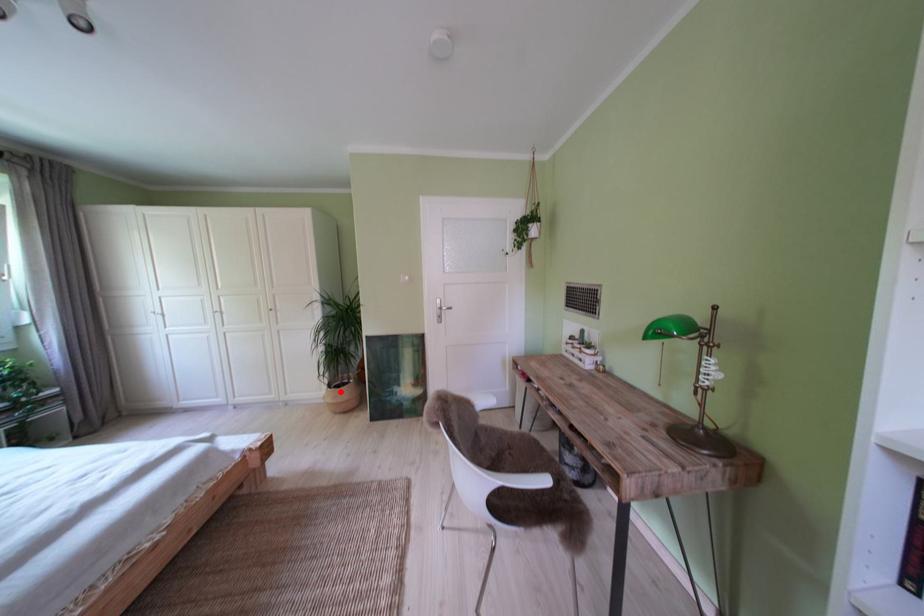
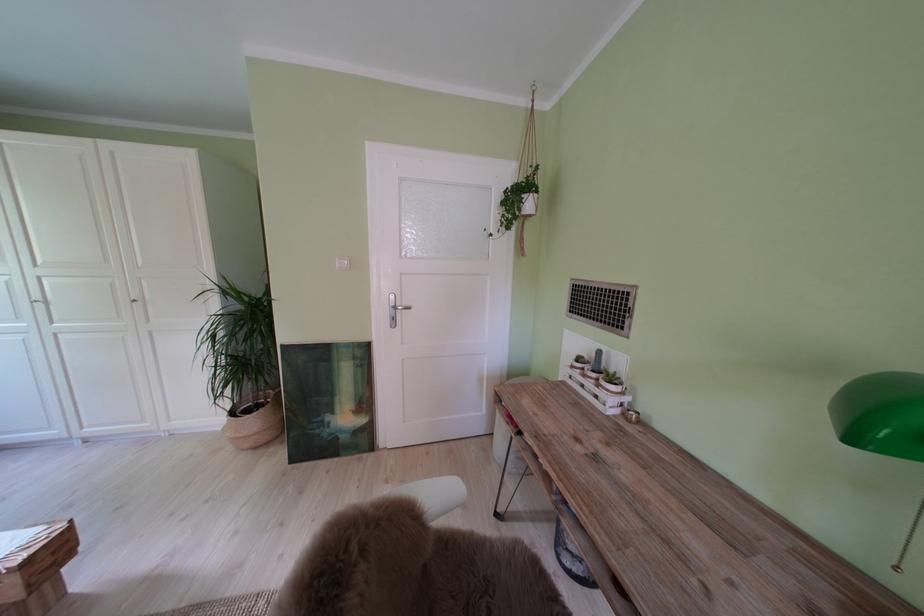
Question: I am providing you with two images of the same scene from different viewpoints. A red point is marked on the first image. At the location where the point appears in image 1, is it still visible in image 2?

Choices:
 (A) Yes
 (B) No

Answer: (A)